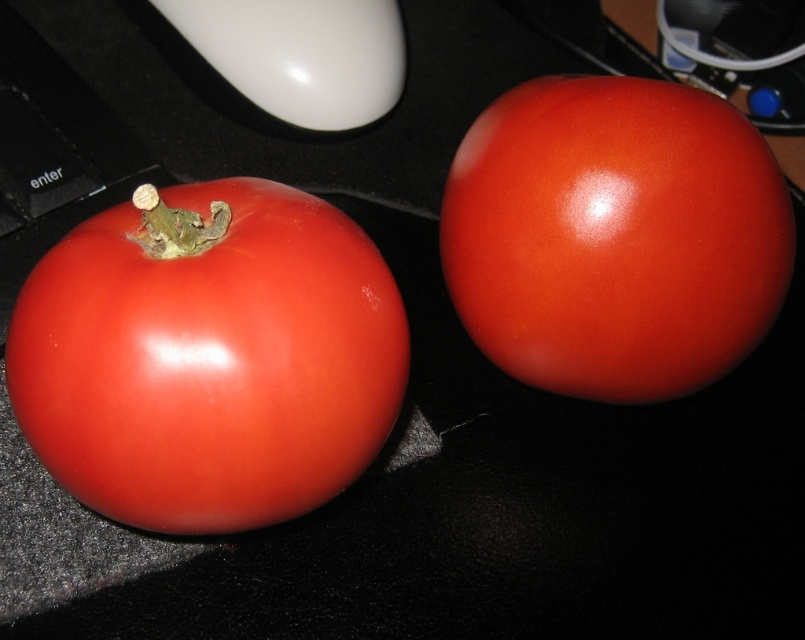
You are standing 30 inches away from a dark table. You see the glossy red tomato at left on the table. Can you reach it without moving your feet?

The glossy red tomato at left is 31.01 inches away from you, so you cannot reach it without moving your feet since it is slightly farther than your current distance of 30 inches.

Consider the image. You need to place both the glossy red tomato at left and the white glossy mouse at upper center into a box that can only fit items up to 10 cm in width. Based on their widths, can both items fit side by side in the box?

The glossy red tomato at left might be wider than the white glossy mouse at upper center, but since the box can fit up to 10 cm, both items could potentially fit side by side if their combined widths are under 10 cm. However, without exact measurements, it is uncertain.

You are standing in front of a dark table with two tomatoes. You need to locate the glossy red tomato at left. According to the coordinates provided, where exactly is it positioned?

The glossy red tomato at left is located at coordinates point (209, 356).